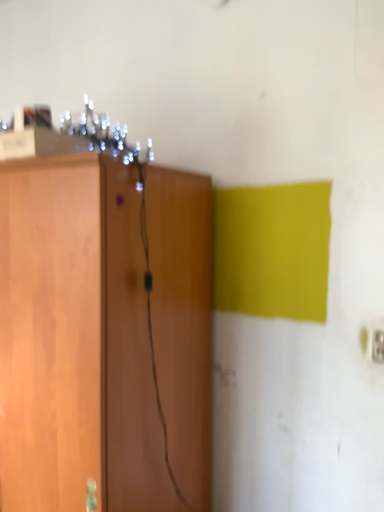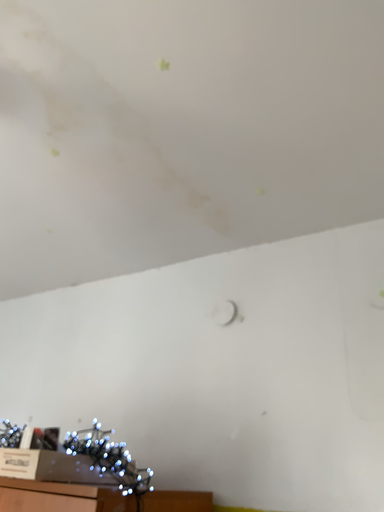
Question: How did the camera likely rotate when shooting the video?

Choices:
 (A) rotated upward
 (B) rotated downward

Answer: (A)